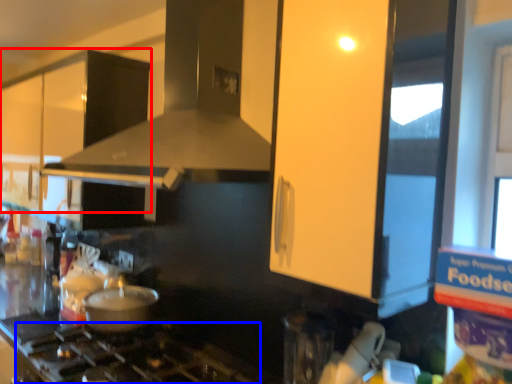
Question: Among these objects, which one is nearest to the camera, cabinetry (highlighted by a red box) or gas stove (highlighted by a blue box)?

Choices:
 (A) cabinetry
 (B) gas stove

Answer: (B)